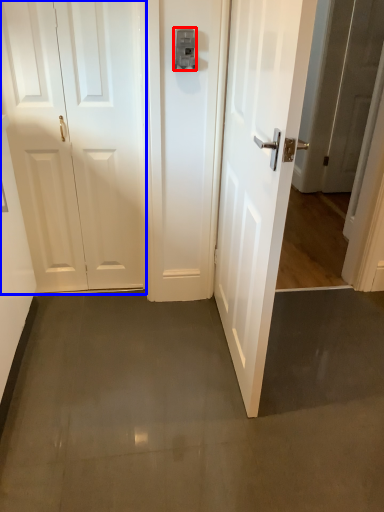
Question: Which point is closer to the camera, latch (highlighted by a red box) or door (highlighted by a blue box)?

Choices:
 (A) latch
 (B) door

Answer: (A)